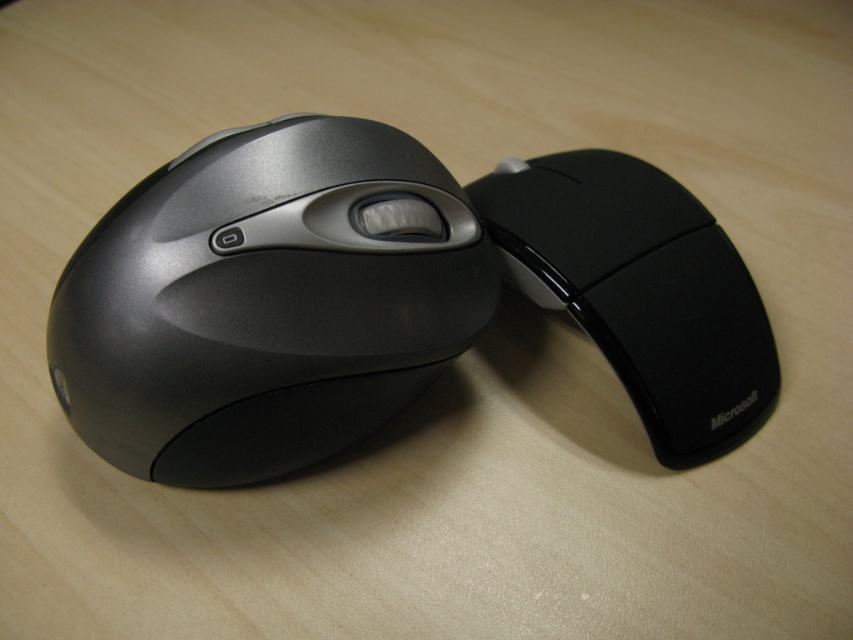
Can you confirm if satin black mouse at center is positioned below black rubberized mouse at right?

Yes.

This screenshot has width=853, height=640. I want to click on satin black mouse at center, so click(267, 301).